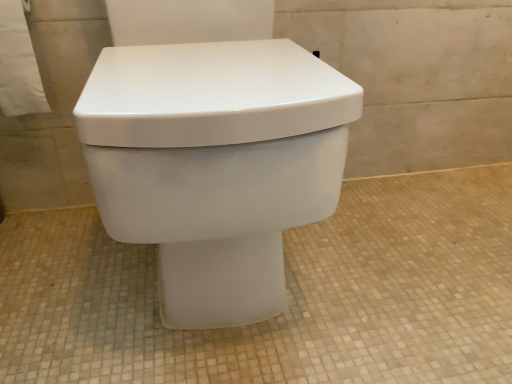
Question: Does point (124, 195) appear closer or farther from the camera than point (25, 51)?

Choices:
 (A) farther
 (B) closer

Answer: (B)

Question: Is white glossy toilet at center inside the boundaries of white paper towel at upper left, or outside?

Choices:
 (A) inside
 (B) outside

Answer: (B)

Question: Which object is positioned closest to the white paper towel at upper left?

Choices:
 (A) white glossy toilet at center
 (B) white matte toilet at center

Answer: (A)

Question: Estimate the real-world distances between objects in this image. Which object is closer to the white glossy toilet at center?

Choices:
 (A) white paper towel at upper left
 (B) white matte toilet at center

Answer: (B)